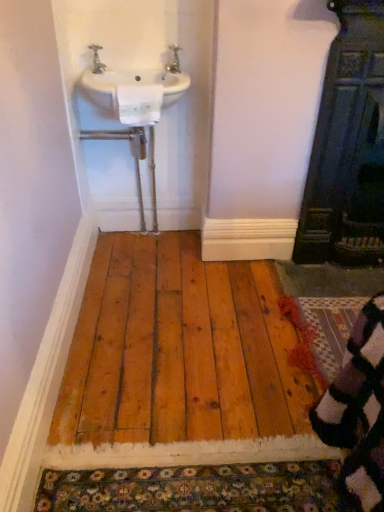
Question: Is white ceramic sink at upper left at the right side of dark wood door at right?

Choices:
 (A) no
 (B) yes

Answer: (A)

Question: From the image's perspective, is white ceramic sink at upper left located beneath dark wood door at right?

Choices:
 (A) no
 (B) yes

Answer: (A)

Question: Can you confirm if white ceramic sink at upper left is positioned to the left of dark wood door at right?

Choices:
 (A) yes
 (B) no

Answer: (A)

Question: Can we say white ceramic sink at upper left lies outside dark wood door at right?

Choices:
 (A) yes
 (B) no

Answer: (A)

Question: From the image's perspective, is white ceramic sink at upper left on top of dark wood door at right?

Choices:
 (A) yes
 (B) no

Answer: (A)

Question: Is white ceramic sink at upper left oriented away from dark wood door at right?

Choices:
 (A) no
 (B) yes

Answer: (A)

Question: Can you confirm if dark wood door at right is smaller than multicolored knitted rug at lower right?

Choices:
 (A) no
 (B) yes

Answer: (A)

Question: Considering the relative sizes of dark wood door at right and multicolored knitted rug at lower right in the image provided, is dark wood door at right shorter than multicolored knitted rug at lower right?

Choices:
 (A) no
 (B) yes

Answer: (A)

Question: Can you confirm if dark wood door at right is taller than multicolored knitted rug at lower right?

Choices:
 (A) no
 (B) yes

Answer: (B)

Question: Is the depth of dark wood door at right less than that of multicolored knitted rug at lower right?

Choices:
 (A) yes
 (B) no

Answer: (A)

Question: Is dark wood door at right wider than multicolored knitted rug at lower right?

Choices:
 (A) no
 (B) yes

Answer: (A)

Question: Is dark wood door at right positioned beyond the bounds of multicolored knitted rug at lower right?

Choices:
 (A) no
 (B) yes

Answer: (B)

Question: Can you confirm if multicolored knitted rug at lower right is taller than silver metallic tap at upper center, which is counted as the second tap, starting from the left?

Choices:
 (A) yes
 (B) no

Answer: (B)